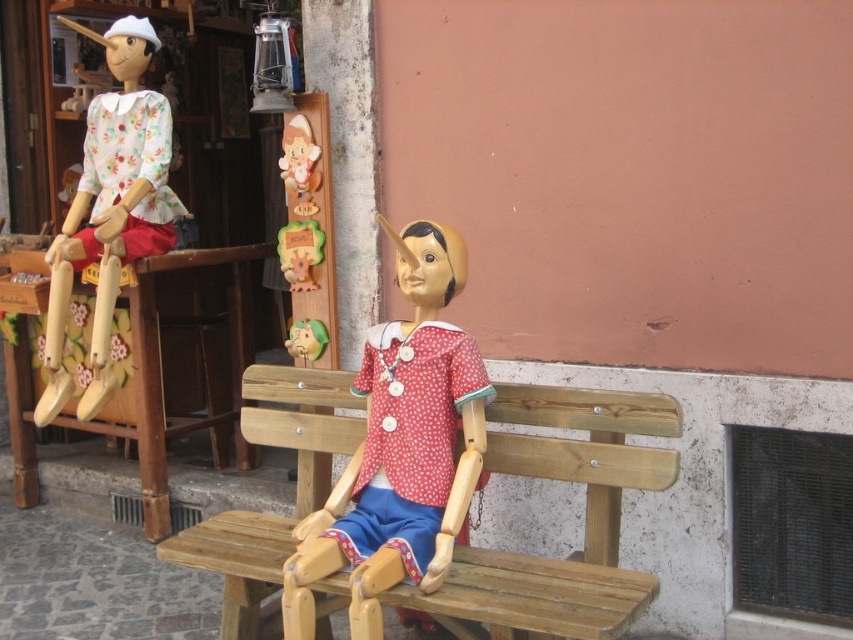
Question: Which object appears farthest from the camera in this image?

Choices:
 (A) wooden bench at center
 (B) wooden doll at center

Answer: (B)

Question: Among these objects, which one is nearest to the camera?

Choices:
 (A) wooden toy at center
 (B) wooden doll at center
 (C) floral fabric doll at left
 (D) wooden bench at center

Answer: (D)

Question: Can you confirm if wooden bench at center is positioned below wooden toy at center?

Choices:
 (A) yes
 (B) no

Answer: (A)

Question: Is wooden doll at center below floral fabric doll at left?

Choices:
 (A) yes
 (B) no

Answer: (A)

Question: Which of the following is the farthest from the observer?

Choices:
 (A) (306, 326)
 (B) (662, 481)
 (C) (369, 477)

Answer: (A)

Question: Can you confirm if wooden bench at center is positioned to the right of matte green wooden toy at center?

Choices:
 (A) no
 (B) yes

Answer: (B)